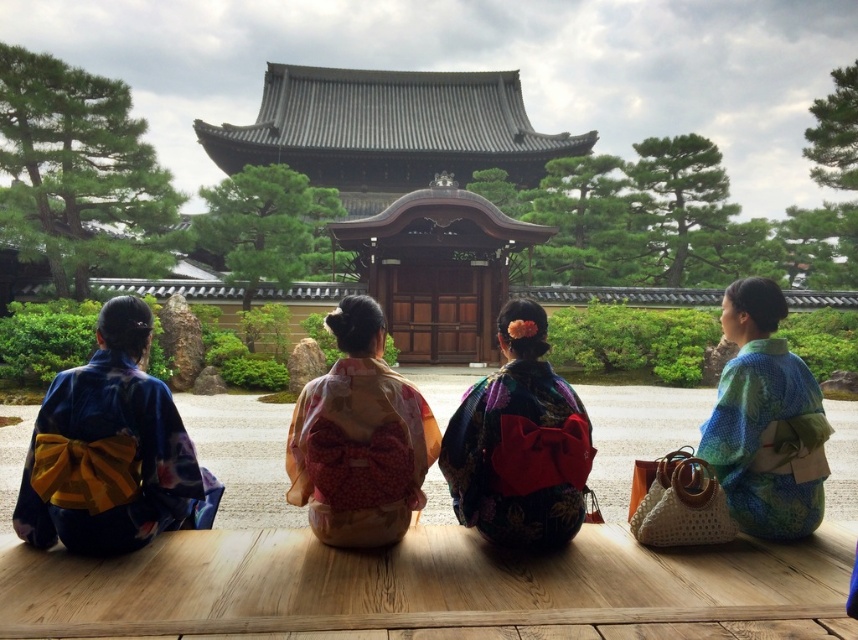
Is matte pink kimono at center behind blue-green silk kimono at right?

No, matte pink kimono at center is closer to the viewer.

Between point (406, 522) and point (733, 342), which one is positioned behind?

Point (733, 342)

Locate an element on the screen. matte pink kimono at center is located at coordinates (360, 438).

At what (x,y) coordinates should I click in order to perform the action: click on matte pink kimono at center. Please return your answer as a coordinate pair (x, y). The height and width of the screenshot is (640, 858). Looking at the image, I should click on (360, 438).

Who is shorter, matte blue kimono at left or matte pink kimono at center?

matte pink kimono at center

Who is taller, matte blue kimono at left or matte pink kimono at center?

matte blue kimono at left is taller.

Locate an element on the screen. This screenshot has height=640, width=858. matte blue kimono at left is located at coordinates (112, 451).

Where is `matte blue kimono at left`? matte blue kimono at left is located at coordinates (112, 451).

Between matte pink kimono at center and silky floral kimono at center, which one appears on the left side from the viewer's perspective?

matte pink kimono at center is more to the left.

Which is above, matte pink kimono at center or silky floral kimono at center?

silky floral kimono at center is higher up.

Who is more forward, (x=304, y=474) or (x=566, y=424)?

Point (x=566, y=424) is in front.

Where is `matte pink kimono at center`? matte pink kimono at center is located at coordinates (360, 438).